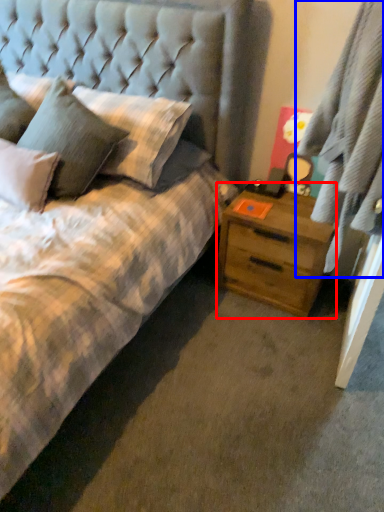
Question: Among these objects, which one is farthest to the camera, nightstand (highlighted by a red box) or curtain (highlighted by a blue box)?

Choices:
 (A) nightstand
 (B) curtain

Answer: (A)